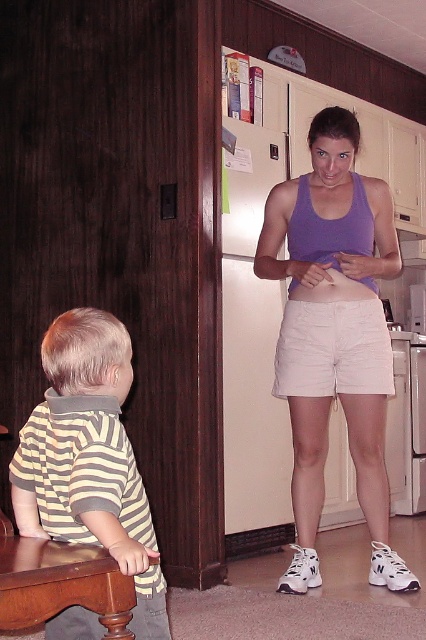
Question: Which object is the farthest from the striped cotton shirt at left?

Choices:
 (A) brown wood stool at lower left
 (B) beige cotton shorts at center

Answer: (B)

Question: Can you confirm if striped cotton shirt at left is bigger than beige cotton shorts at center?

Choices:
 (A) yes
 (B) no

Answer: (A)

Question: Based on their relative distances, which object is farther from the purple cotton tank top at center?

Choices:
 (A) striped cotton shirt at left
 (B) brown wood stool at lower left

Answer: (B)

Question: Where is purple cotton tank top at center located in relation to brown wood stool at lower left in the image?

Choices:
 (A) right
 (B) left

Answer: (A)

Question: Can you confirm if beige cotton shorts at center is positioned above brown wood stool at lower left?

Choices:
 (A) no
 (B) yes

Answer: (B)

Question: Which point appears closest to the camera in this image?

Choices:
 (A) (385, 388)
 (B) (74, 540)
 (C) (299, 536)
 (D) (112, 595)

Answer: (D)